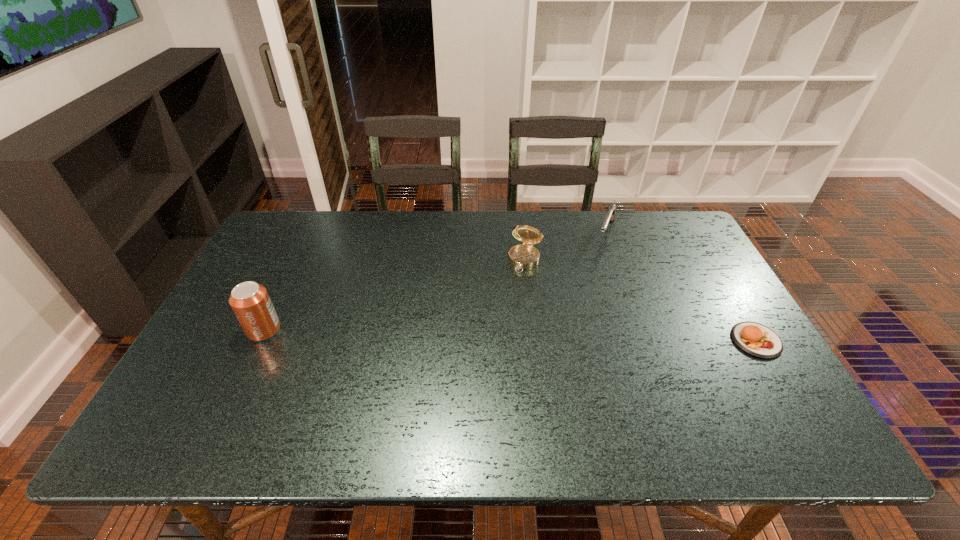
Where is `vacant spot on the desktop that is between the leftmost object and the shortest object and is positioned with the dial facing the second object from left to right`? The image size is (960, 540). vacant spot on the desktop that is between the leftmost object and the shortest object and is positioned with the dial facing the second object from left to right is located at coordinates (493, 335).

At what (x,y) coordinates should I click in order to perform the action: click on vacant spot on the desktop that is between the tallest object and the rightmost object and is positioned aiming along the barrel of the third tallest object. Please return your answer as a coordinate pair (x, y). Looking at the image, I should click on (565, 336).